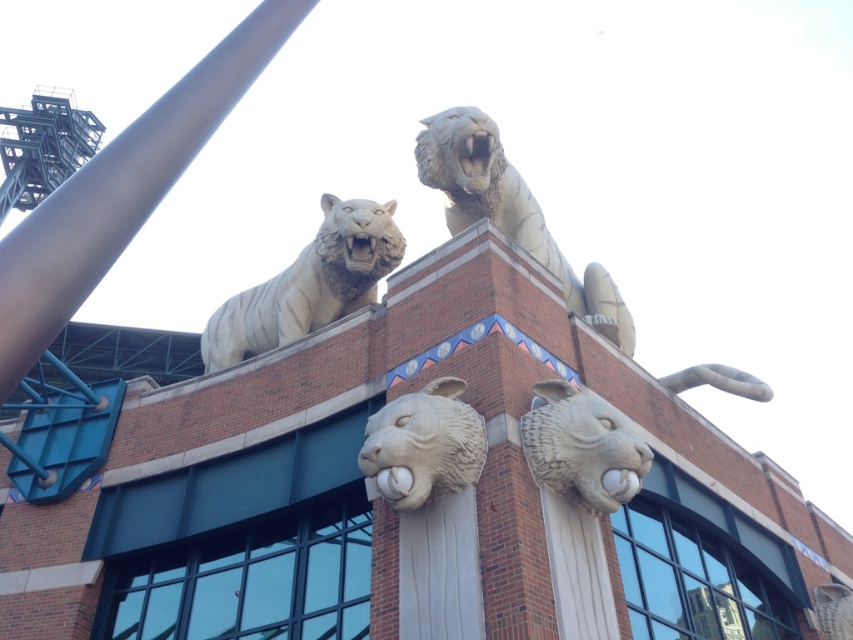
Question: Is white stone tiger at upper center smaller than white stone tiger head at center?

Choices:
 (A) no
 (B) yes

Answer: (A)

Question: Among these objects, which one is farthest from the camera?

Choices:
 (A) white stone tiger at upper center
 (B) white stone tiger head at center
 (C) metallic gray pole at upper left

Answer: (A)

Question: Is white stone lion heads at center positioned at the back of metallic gray pole at upper left?

Choices:
 (A) no
 (B) yes

Answer: (B)

Question: Is white stone tiger at upper center further to the viewer compared to white stone lion head at center?

Choices:
 (A) yes
 (B) no

Answer: (A)

Question: Which object appears farthest from the camera in this image?

Choices:
 (A) metallic gray pole at upper left
 (B) white stone tiger at upper center
 (C) white stone tiger head at center
 (D) white stone lion heads at center

Answer: (B)

Question: Estimate the real-world distances between objects in this image. Which object is closer to the white stone lion at upper center?

Choices:
 (A) white stone tiger at upper center
 (B) white stone tiger head at center
 (C) metallic gray pole at upper left
 (D) white stone lion head at center

Answer: (A)